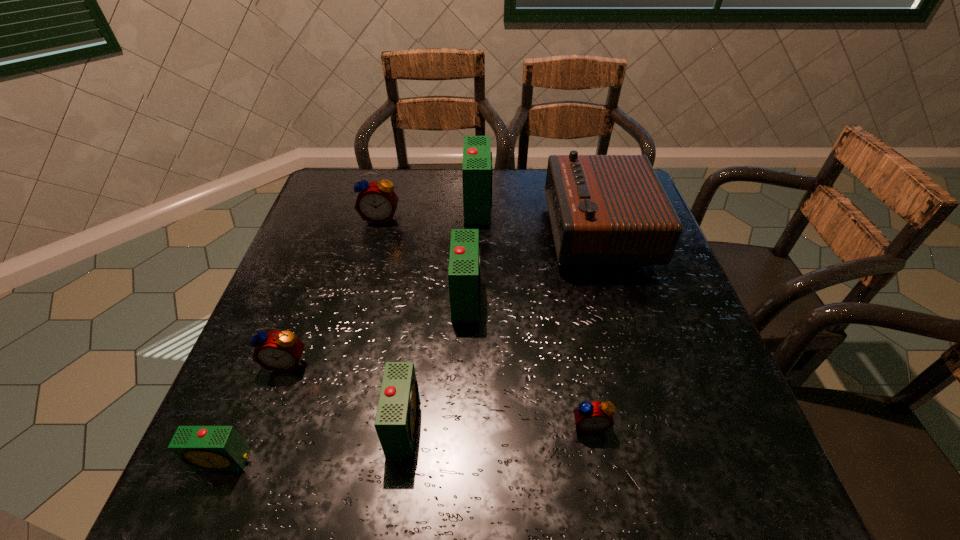
Image resolution: width=960 pixels, height=540 pixels. In the image, there is a desktop. Identify the location of vacant space at the left edge. (228, 406).

Locate an element on the screen. vacant space at the right edge of the desktop is located at coordinates (678, 316).

In the image, there is a desktop. Identify the location of free region at the near left corner. (285, 472).

Identify the location of free space at the near right corner of the desktop. This screenshot has height=540, width=960. (763, 484).

Where is `empty space between the brown radio receiver and the third biggest green alarm clock`? empty space between the brown radio receiver and the third biggest green alarm clock is located at coordinates (x=501, y=328).

Locate an element on the screen. The image size is (960, 540). unoccupied position between the brown radio receiver and the smallest green alarm clock is located at coordinates (411, 346).

You are a GUI agent. You are given a task and a screenshot of the screen. Output one action in this format:
    pyautogui.click(x=<x>, y=<y>)
    Task: Click on the free area in between the third alarm clock from left to right and the second biggest green alarm clock
    The height and width of the screenshot is (540, 960).
    Given the screenshot: What is the action you would take?
    pyautogui.click(x=423, y=257)

At what (x,y) coordinates should I click in order to perform the action: click on free space that is in between the smallest green alarm clock and the second biggest green alarm clock. Please return your answer as a coordinate pair (x, y). Looking at the image, I should click on [345, 379].

Find the location of `free spot between the farthest green alarm clock and the second smallest red alarm clock`. free spot between the farthest green alarm clock and the second smallest red alarm clock is located at coordinates (383, 284).

Locate an element on the screen. free space between the nearest red alarm clock and the sixth object from right to left is located at coordinates (485, 321).